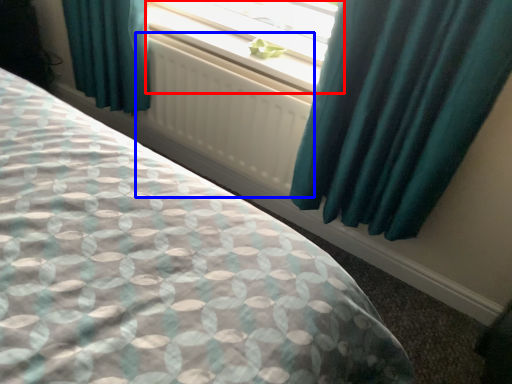
Question: Which object is closer to the camera taking this photo, window (highlighted by a red box) or radiator (highlighted by a blue box)?

Choices:
 (A) window
 (B) radiator

Answer: (B)